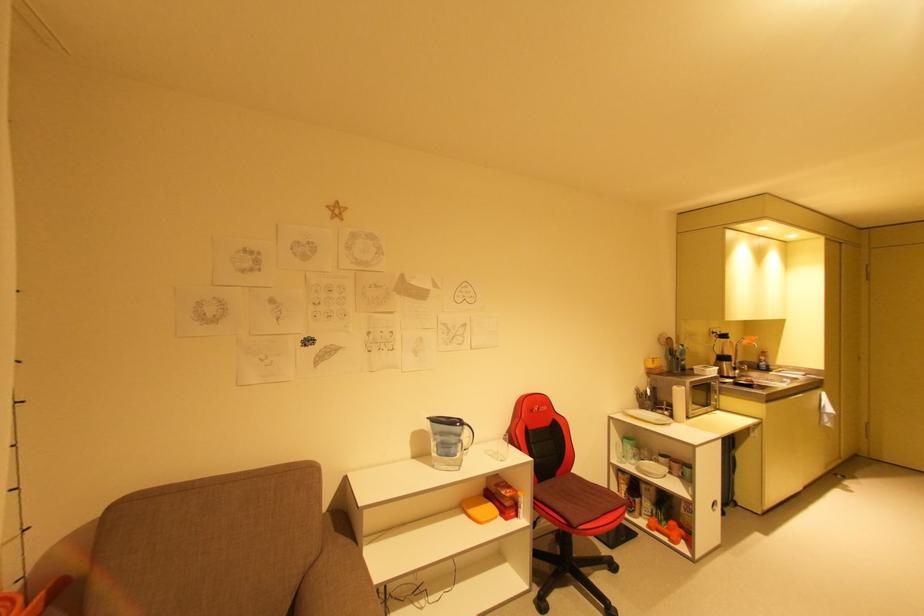
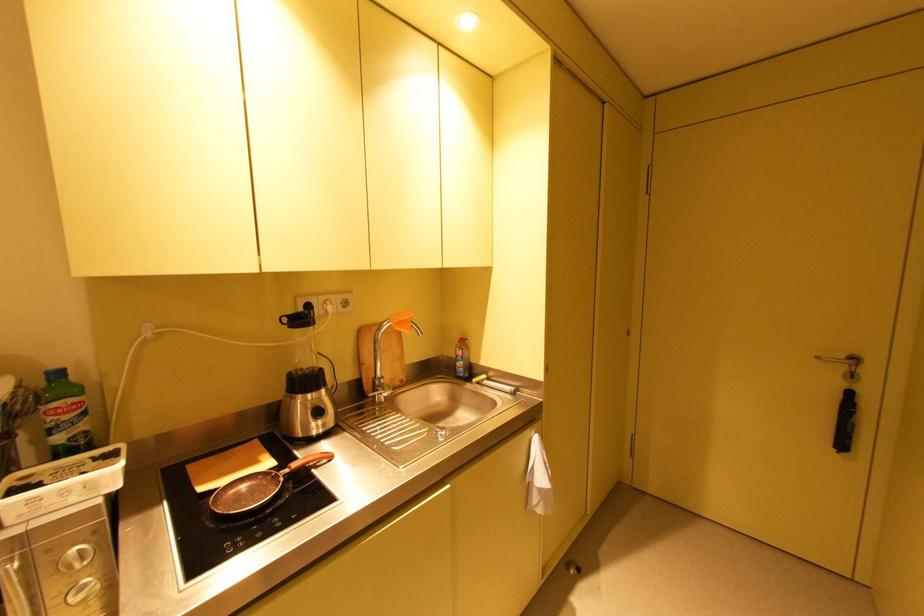
Which direction would the cameraman need to move to produce the second image?

The movement direction of the cameraman is right, forward.